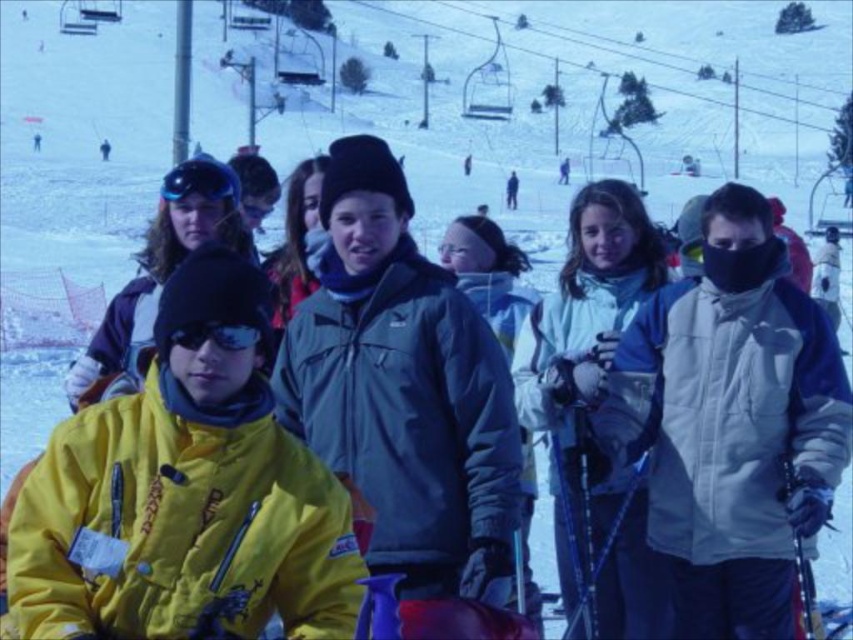
Question: Which object appears farthest from the camera in this image?

Choices:
 (A) black reflective goggles at center
 (B) blue matte helmet at upper left

Answer: (B)

Question: Among these objects, which one is nearest to the camera?

Choices:
 (A) black reflective goggles at center
 (B) blue matte helmet at upper left

Answer: (A)

Question: Does blue matte helmet at upper left have a smaller size compared to black reflective goggles at center?

Choices:
 (A) no
 (B) yes

Answer: (A)

Question: Is blue matte helmet at upper left above black reflective goggles at center?

Choices:
 (A) no
 (B) yes

Answer: (B)

Question: Is blue matte helmet at upper left thinner than black reflective goggles at center?

Choices:
 (A) yes
 (B) no

Answer: (B)